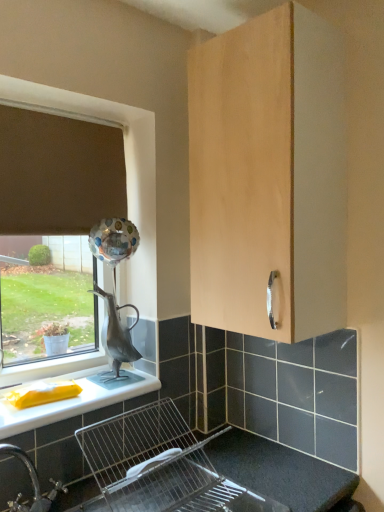
Question: Is brown fabric curtain at upper left located outside light wood cabinet at upper center?

Choices:
 (A) yes
 (B) no

Answer: (A)

Question: Is brown fabric curtain at upper left to the left of light wood cabinet at upper center from the viewer's perspective?

Choices:
 (A) yes
 (B) no

Answer: (A)

Question: Is brown fabric curtain at upper left to the right of light wood cabinet at upper center from the viewer's perspective?

Choices:
 (A) yes
 (B) no

Answer: (B)

Question: Is brown fabric curtain at upper left oriented away from light wood cabinet at upper center?

Choices:
 (A) yes
 (B) no

Answer: (B)

Question: From a real-world perspective, is brown fabric curtain at upper left positioned over light wood cabinet at upper center based on gravity?

Choices:
 (A) no
 (B) yes

Answer: (B)

Question: From the image's perspective, would you say brown fabric curtain at upper left is shown under light wood cabinet at upper center?

Choices:
 (A) no
 (B) yes

Answer: (A)

Question: Is metallic silver sink at lower center wider than white glossy countertop at lower left?

Choices:
 (A) yes
 (B) no

Answer: (A)

Question: Can white glossy countertop at lower left be found inside metallic silver sink at lower center?

Choices:
 (A) no
 (B) yes

Answer: (A)

Question: Is metallic silver sink at lower center taller than white glossy countertop at lower left?

Choices:
 (A) yes
 (B) no

Answer: (A)

Question: From a real-world perspective, is metallic silver sink at lower center on top of white glossy countertop at lower left?

Choices:
 (A) yes
 (B) no

Answer: (B)

Question: Can you confirm if metallic silver sink at lower center is smaller than white glossy countertop at lower left?

Choices:
 (A) yes
 (B) no

Answer: (B)

Question: Is metallic silver sink at lower center oriented away from white glossy countertop at lower left?

Choices:
 (A) yes
 (B) no

Answer: (A)

Question: Can you confirm if brown fabric curtain at upper left is bigger than metallic silver sink at lower center?

Choices:
 (A) yes
 (B) no

Answer: (B)